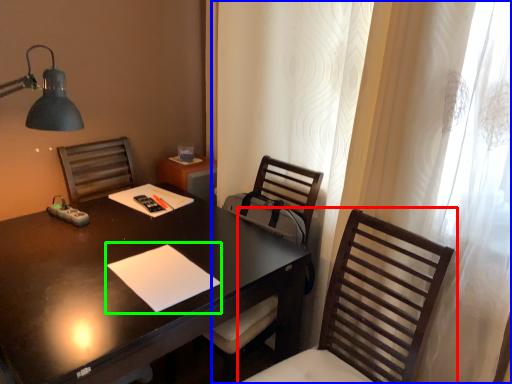
Question: Considering the real-world distances, which object is closest to chair (highlighted by a red box)? curtain (highlighted by a blue box) or notepad (highlighted by a green box).

Choices:
 (A) curtain
 (B) notepad

Answer: (A)